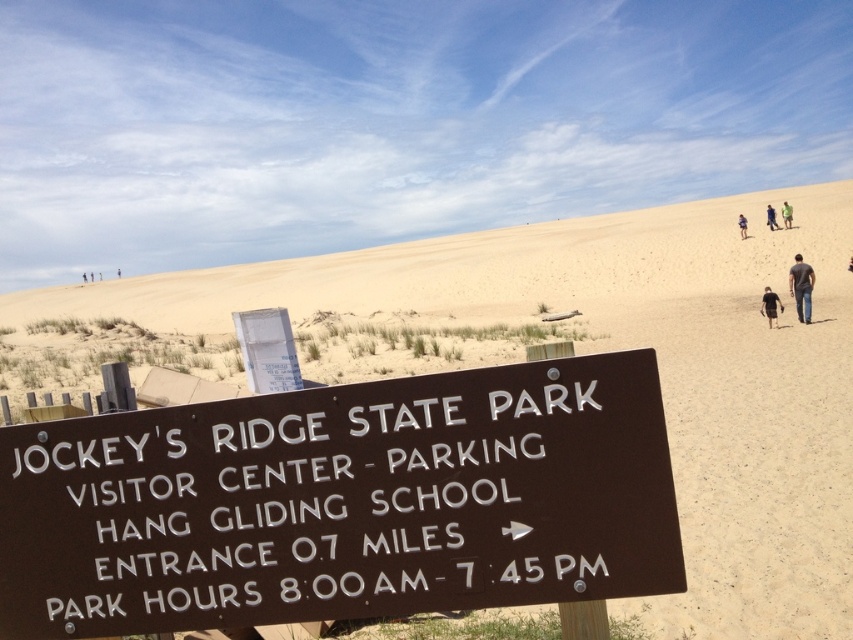
You are at Jockey Ridge State Park and want to know which of the two clothing items, the dark blue jeans at lower right or the green fabric pants at upper right, is bigger in size. Can you tell me which one is larger?

The dark blue jeans at lower right is larger in size than the green fabric pants at upper right.

You are a park ranger at Jockey Ridge State Park and you need to walk from the dark blue jeans at lower right to the green fabric shirt at upper right. How far will you have to walk?

The distance between the dark blue jeans at lower right and the green fabric shirt at upper right is 19.25 meters, so you will have to walk 19.25 meters.

You are a photographer at Jockey Ridge State Park and want to capture a photo of the dark blue jeans at lower right and the black fabric shirt at lower center. Which object is located to the right of the other?

The dark blue jeans at lower right is positioned on the right side of black fabric shirt at lower center, so the dark blue jeans at lower right is to the right of the black fabric shirt at lower center.